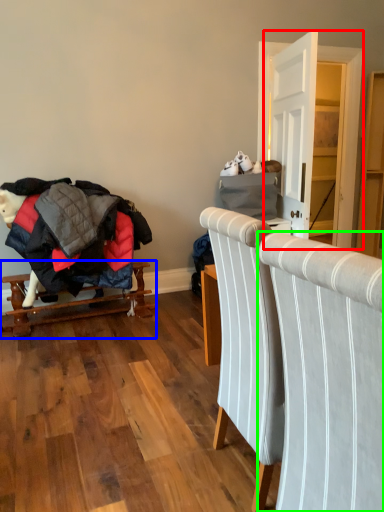
Question: Which object is the farthest from dresser (highlighted by a red box)? Choose among these: furniture (highlighted by a blue box) or chair (highlighted by a green box).

Choices:
 (A) furniture
 (B) chair

Answer: (B)